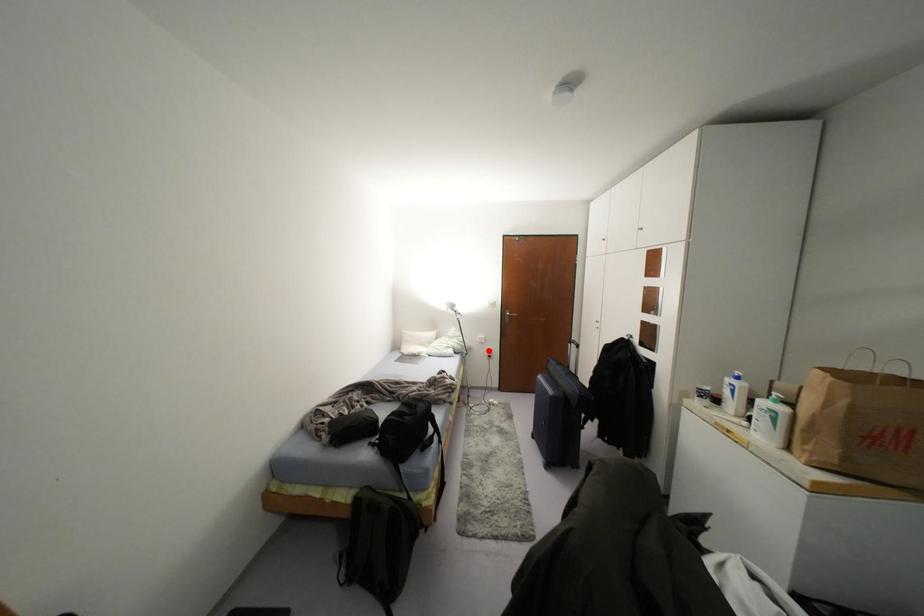
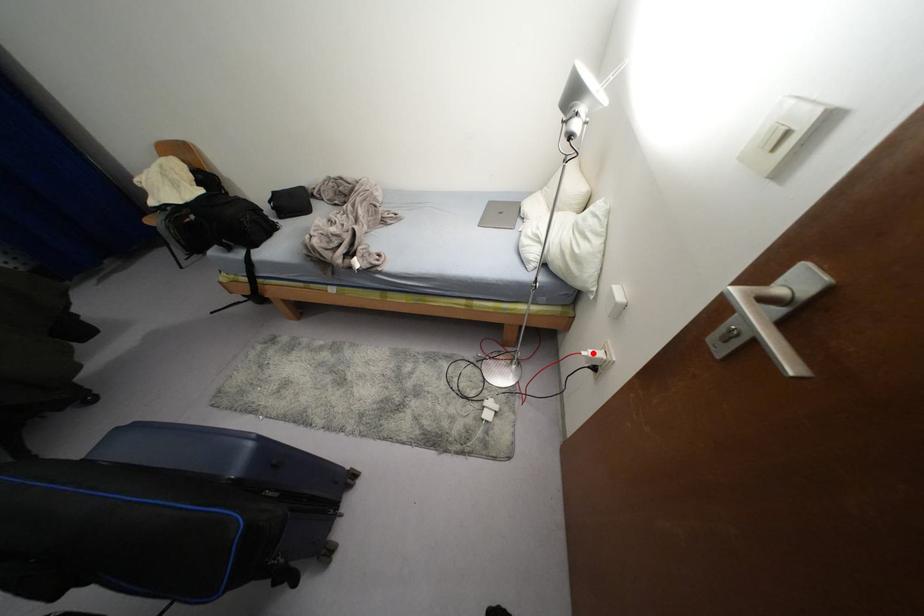
I am providing you with two images of the same scene from different viewpoints. A red point is marked on the first image and another point is marked on the second image. Do the highlighted points in image1 and image2 indicate the same real-world spot?

Yes